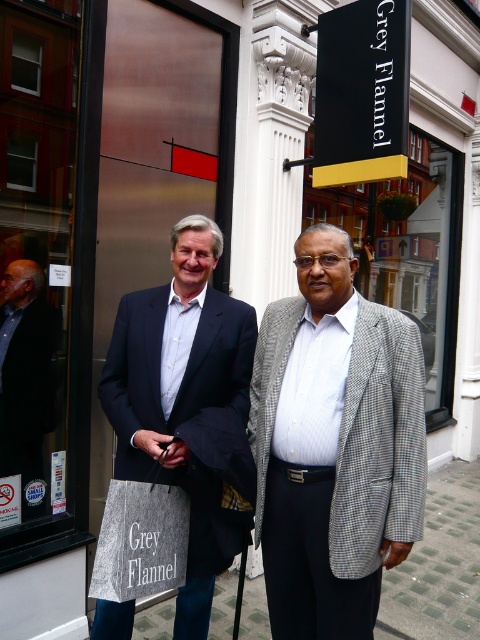
In the scene shown: Is checkered fabric suit at center taller than gray checkered blazer at center?

Yes.

In the scene shown: Does checkered fabric suit at center have a lesser width compared to gray checkered blazer at center?

No, checkered fabric suit at center is not thinner than gray checkered blazer at center.

Does point (296, 388) lie behind point (387, 388)?

Yes, it is.

This screenshot has height=640, width=480. I want to click on checkered fabric suit at center, so click(335, 445).

Does point (357, 467) lie behind point (396, 275)?

No, it is not.

The height and width of the screenshot is (640, 480). What do you see at coordinates (379, 442) in the screenshot?
I see `gray checkered blazer at center` at bounding box center [379, 442].

You are a GUI agent. You are given a task and a screenshot of the screen. Output one action in this format:
    pyautogui.click(x=<x>, y=<y>)
    Task: Click on the gray checkered blazer at center
    
    Given the screenshot: What is the action you would take?
    pyautogui.click(x=379, y=442)

This screenshot has width=480, height=640. Describe the element at coordinates (379, 442) in the screenshot. I see `gray checkered blazer at center` at that location.

Is gray checkered blazer at center thinner than matte black suit at left?

No.

The width and height of the screenshot is (480, 640). I want to click on gray checkered blazer at center, so click(x=379, y=442).